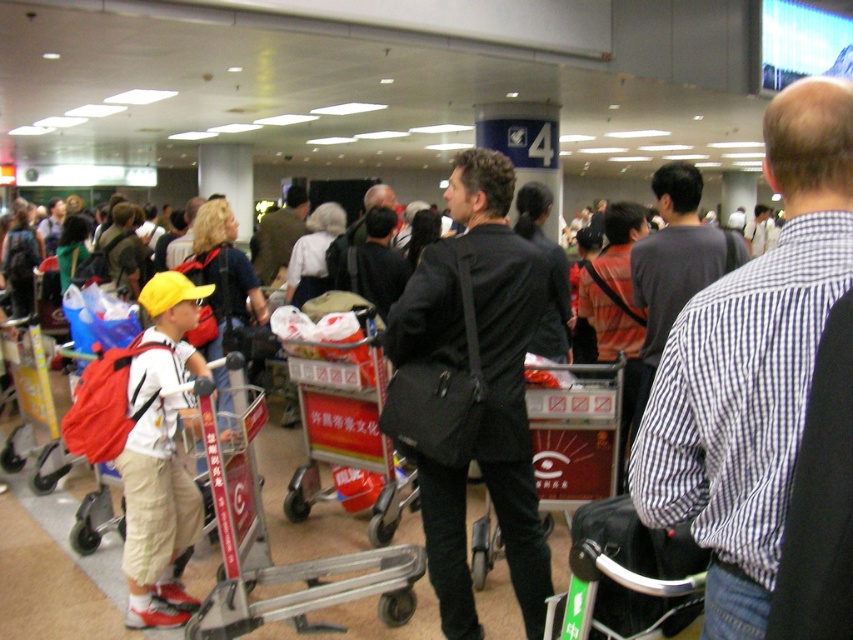
You are standing at the entrance of the baggage claim area and want to locate the black matte jacket at center. According to the coordinates provided, where should you look to find it?

The black matte jacket at center is located at coordinates point (471, 388).